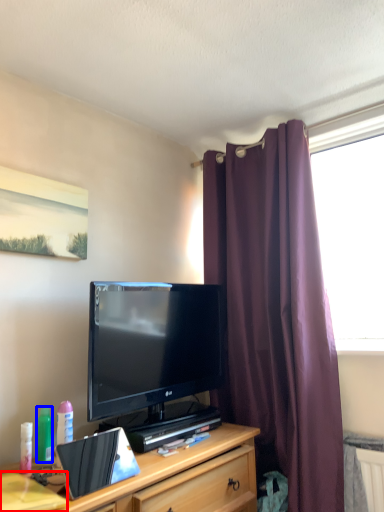
Question: Which of the following is the farthest to the observer, desk (highlighted by a red box) or bottle (highlighted by a blue box)?

Choices:
 (A) desk
 (B) bottle

Answer: (B)